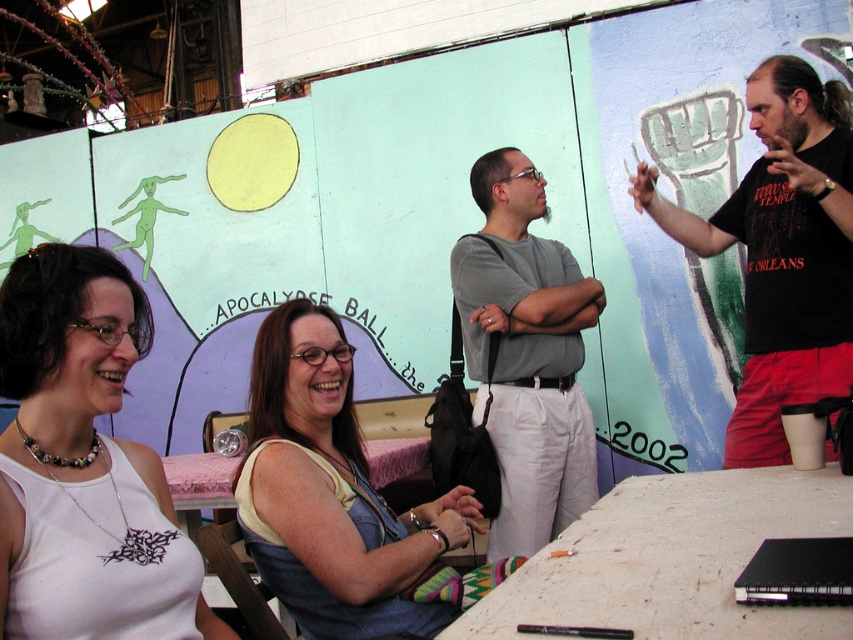
Question: Can you confirm if denim vest at center is positioned below black t-shirt at upper right?

Choices:
 (A) no
 (B) yes

Answer: (B)

Question: Does white matte table at lower right come in front of gray cotton shirt at center?

Choices:
 (A) yes
 (B) no

Answer: (A)

Question: Does white matte table at lower right lie behind gray cotton shirt at center?

Choices:
 (A) yes
 (B) no

Answer: (B)

Question: Estimate the real-world distances between objects in this image. Which object is closer to the denim vest at center?

Choices:
 (A) black t-shirt at upper right
 (B) white matte table at lower right

Answer: (B)

Question: Estimate the real-world distances between objects in this image. Which object is farther from the black t-shirt at upper right?

Choices:
 (A) white matte tank top at lower left
 (B) gray cotton shirt at center
 (C) denim vest at center

Answer: (A)

Question: Which object is positioned closest to the black t-shirt at upper right?

Choices:
 (A) denim vest at center
 (B) white matte table at lower right
 (C) gray cotton shirt at center

Answer: (C)